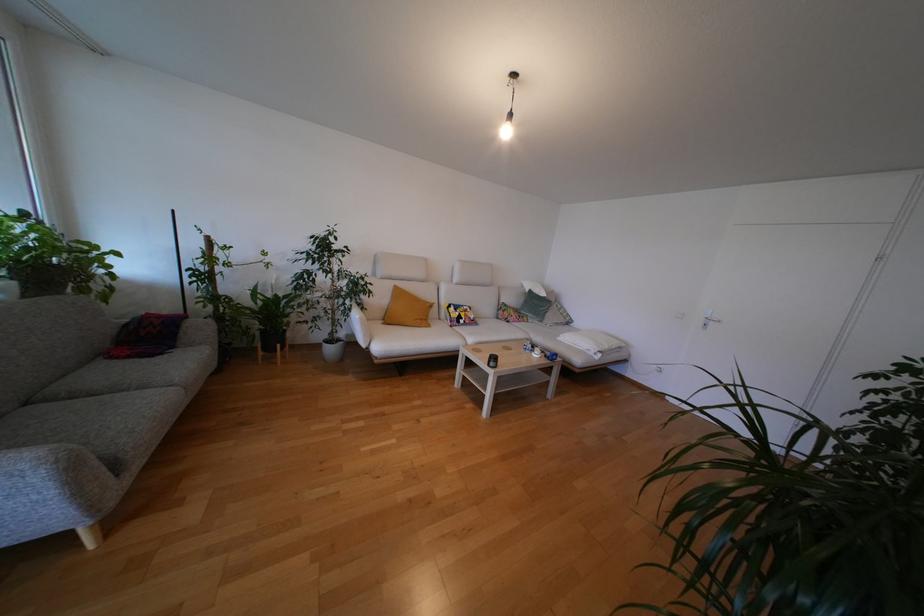
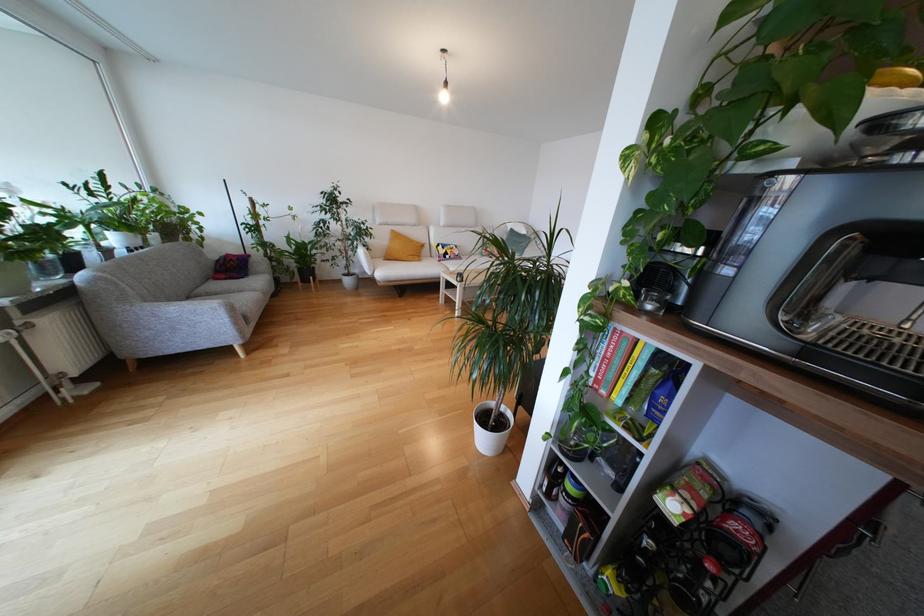
Locate, in the second image, the point that corresponds to the point at 463,326 in the first image.

(448, 262)